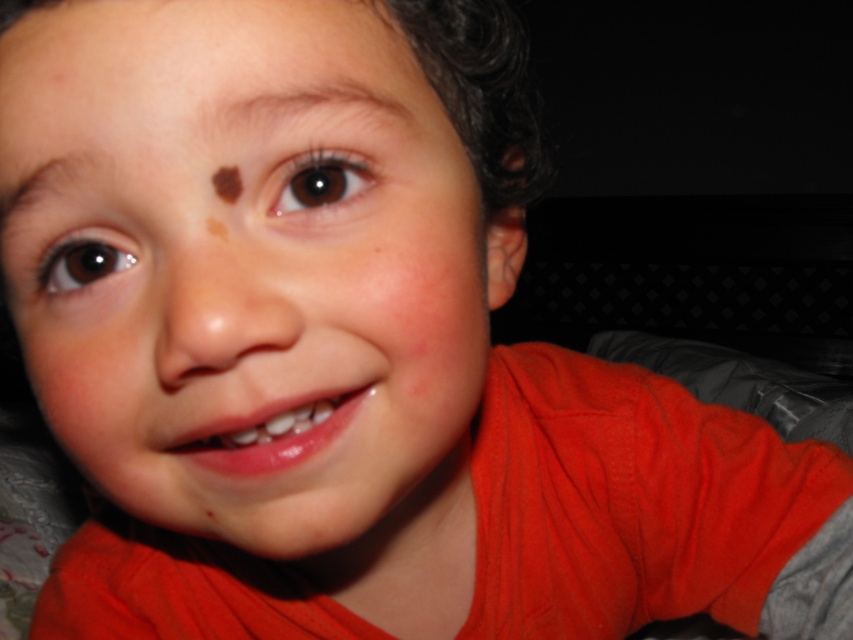
Is brown skin at upper center taller than brown shiny eye at left?

Yes.

Can you confirm if brown skin at upper center is positioned to the left of brown shiny eye at left?

Incorrect, brown skin at upper center is not on the left side of brown shiny eye at left.

Identify the location of brown skin at upper center. (439, 49).

Locate an element on the screen. The image size is (853, 640). brown skin at upper center is located at coordinates (439, 49).

Between smooth skin face at center and brown smooth eyebrow at upper left, which one appears on the left side from the viewer's perspective?

From the viewer's perspective, brown smooth eyebrow at upper left appears more on the left side.

Between point (445, 138) and point (61, 177), which one is positioned behind?

The point (445, 138) is behind.

Identify the location of smooth skin face at center. (252, 272).

Who is positioned more to the left, brown skin at upper center or brown shiny eye at upper right?

brown skin at upper center is more to the left.

Who is positioned more to the right, brown skin at upper center or brown shiny eye at upper right?

Positioned to the right is brown shiny eye at upper right.

Image resolution: width=853 pixels, height=640 pixels. I want to click on brown skin at upper center, so click(439, 49).